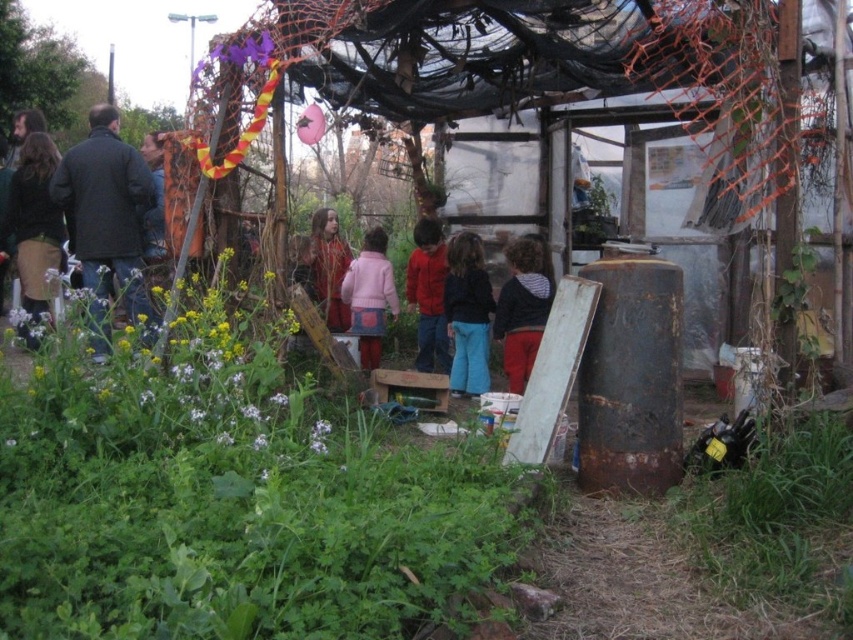
You are standing in the center of the community garden and see the pink matte jacket at center. If you walk straight ahead, will you step on the jacket?

The pink matte jacket at center is located at point (370, 296), which is slightly to the right and forward from the exact center. Therefore, walking straight ahead might not directly step on the jacket unless you adjust your path slightly to the right.

You are a gardener who wants to plant a new row of vegetables between the green leafy plants at center and the pink matte jacket at center. Which object should you use as a reference point for height measurement to ensure proper spacing?

The pink matte jacket at center is taller than the green leafy plants at center, so you should use the pink matte jacket at center as the reference point for height measurement to ensure proper spacing.